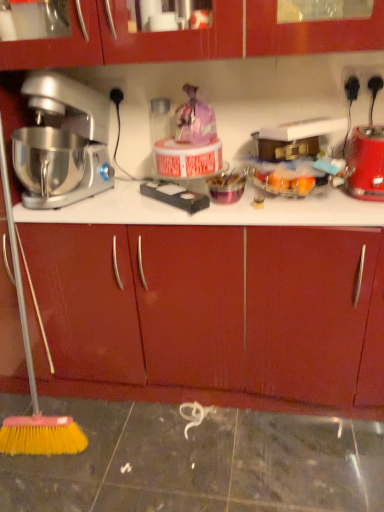
Describe the element at coordinates (367, 155) in the screenshot. I see `red plastic blender at right` at that location.

You are a GUI agent. You are given a task and a screenshot of the screen. Output one action in this format:
    pyautogui.click(x=<x>, y=<y>)
    Task: Click on the silver metallic mixer at left
    The image size is (384, 512).
    Given the screenshot: What is the action you would take?
    [x=62, y=143]

This screenshot has width=384, height=512. What do you see at coordinates (62, 143) in the screenshot?
I see `silver metallic mixer at left` at bounding box center [62, 143].

Find the location of a particular element. matte wood drawer at center is located at coordinates (212, 314).

Is point (247, 364) positioned in front of point (364, 177)?

No, (247, 364) is behind (364, 177).

From a real-world perspective, who is located higher, matte wood drawer at center or red plastic blender at right?

red plastic blender at right.

Considering the relative sizes of matte wood drawer at center and red plastic blender at right in the image provided, is matte wood drawer at center bigger than red plastic blender at right?

Yes, matte wood drawer at center is bigger than red plastic blender at right.

Consider the image. What's the angular difference between red plastic blender at right and matte wood drawer at center's facing directions?

red plastic blender at right and matte wood drawer at center are facing 5.52 degrees away from each other.

Which object is positioned more to the right, red plastic blender at right or matte wood drawer at center?

From the viewer's perspective, red plastic blender at right appears more on the right side.

From the image's perspective, is red plastic blender at right beneath matte wood drawer at center?

No, from the image's perspective, red plastic blender at right is not below matte wood drawer at center.

Looking at the image, does red plastic blender at right seem bigger or smaller compared to matte wood drawer at center?

Considering their sizes, red plastic blender at right takes up less space than matte wood drawer at center.

Is the position of silver metallic mixer at left more distant than that of matte wood drawer at center?

No.

From the picture: Considering the sizes of objects silver metallic mixer at left and matte wood drawer at center in the image provided, who is shorter, silver metallic mixer at left or matte wood drawer at center?

silver metallic mixer at left is shorter.

Does silver metallic mixer at left touch red plastic blender at right?

There is a gap between silver metallic mixer at left and red plastic blender at right.

Between point (13, 135) and point (374, 175), which one is positioned behind?

The point (13, 135) is behind.

From a real-world perspective, does silver metallic mixer at left stand above red plastic blender at right?

Yes, from a real-world perspective, silver metallic mixer at left is over red plastic blender at right

Looking at their sizes, would you say matte wood drawer at center is wider or thinner than silver metallic mixer at left?

In the image, matte wood drawer at center appears to be more narrow than silver metallic mixer at left.

Considering their positions, is matte wood drawer at center located in front of or behind silver metallic mixer at left?

Visually, matte wood drawer at center is located behind silver metallic mixer at left.

Are matte wood drawer at center and silver metallic mixer at left far apart?

No, matte wood drawer at center is not far away from silver metallic mixer at left.

From the picture: Which object is further away from the camera, red plastic blender at right or silver metallic mixer at left?

red plastic blender at right is more distant.

Is red plastic blender at right to the left of silver metallic mixer at left from the viewer's perspective?

No.

Does red plastic blender at right turn towards silver metallic mixer at left?

No, red plastic blender at right does not turn towards silver metallic mixer at left.

Consider the image. From a real-world perspective, which is physically above, red plastic blender at right or silver metallic mixer at left?

In real-world perspective, silver metallic mixer at left is above.

This screenshot has width=384, height=512. Identify the location of drawer located on the left of red plastic blender at right. (212, 314).

Find the location of a particular element. The width and height of the screenshot is (384, 512). blender lying on the right of matte wood drawer at center is located at coordinates (367, 155).

Estimate the real-world distances between objects in this image. Which object is further from red plastic blender at right, silver metallic mixer at left or matte wood drawer at center?

silver metallic mixer at left is further to red plastic blender at right.

Considering their positions, is matte wood drawer at center positioned further to silver metallic mixer at left than red plastic blender at right?

The object further to silver metallic mixer at left is red plastic blender at right.

Considering their positions, is red plastic blender at right positioned further to silver metallic mixer at left than matte wood drawer at center?

red plastic blender at right is positioned further to the anchor silver metallic mixer at left.

Considering their positions, is silver metallic mixer at left positioned closer to matte wood drawer at center than red plastic blender at right?

The object closer to matte wood drawer at center is silver metallic mixer at left.

Considering their positions, is red plastic blender at right positioned further to matte wood drawer at center than silver metallic mixer at left?

red plastic blender at right lies further to matte wood drawer at center than the other object.

Which object lies further to the anchor point red plastic blender at right, matte wood drawer at center or silver metallic mixer at left?

silver metallic mixer at left.

In order to click on drawer located between silver metallic mixer at left and red plastic blender at right in the left-right direction in this screenshot , I will do `click(212, 314)`.